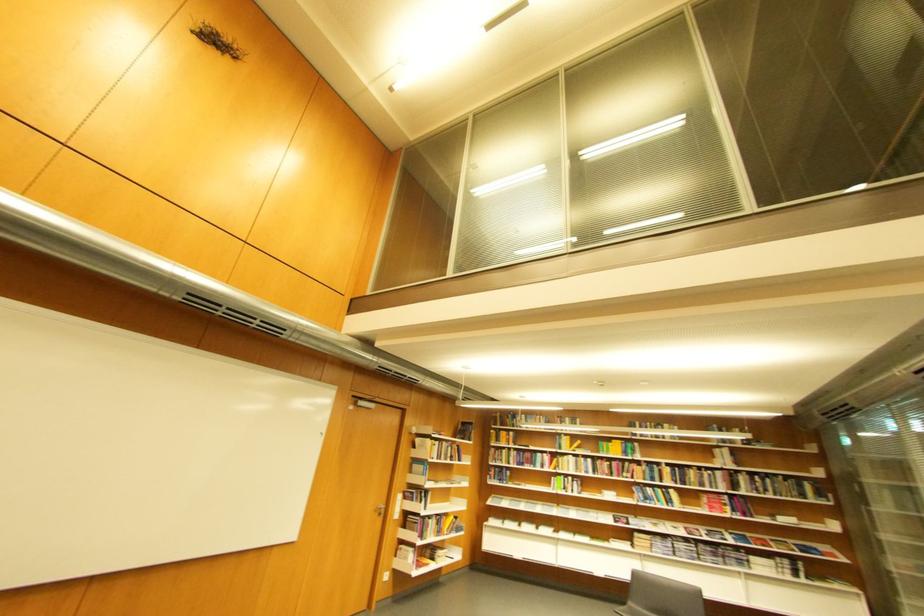
Identify the location of grey chair sitting surface. (657, 610).